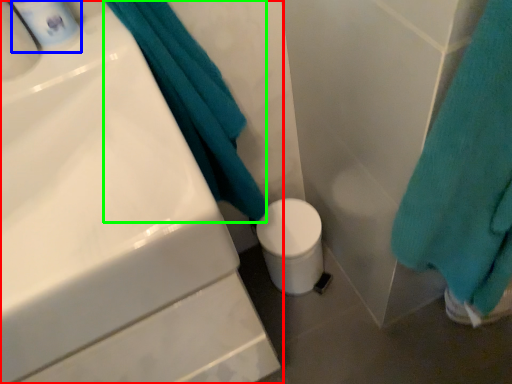
Question: Which is farther away from sink (highlighted by a red box)? mouthwash (highlighted by a blue box) or bath towel (highlighted by a green box)?

Choices:
 (A) mouthwash
 (B) bath towel

Answer: (A)